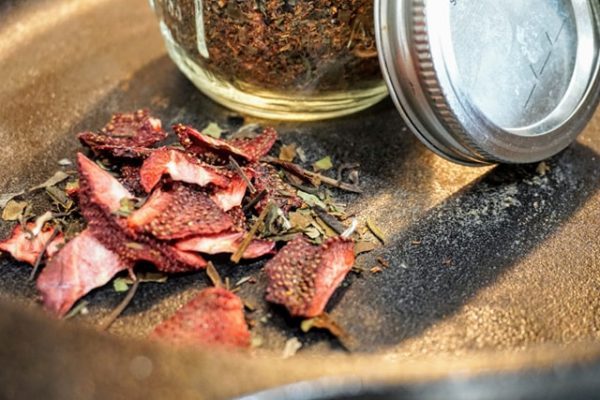
Find the location of a particular element. This screenshot has width=600, height=400. crushed herbs inside of jar is located at coordinates (268, 27).